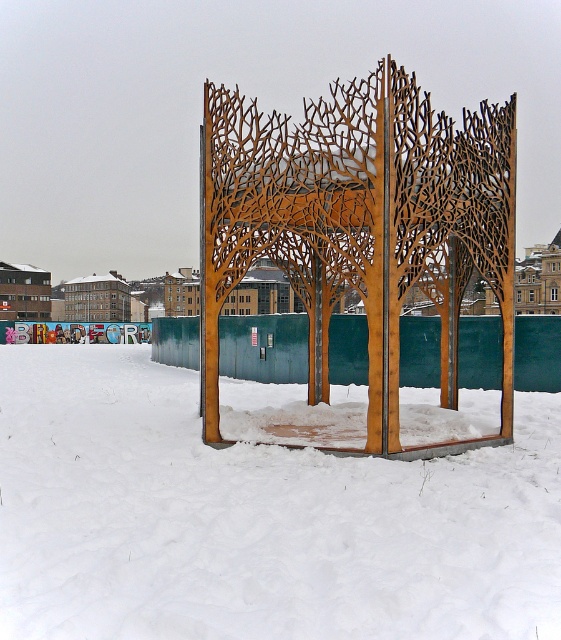
You are standing in the snowy outdoor area and want to walk towards the wooden lattice structure at center. Which direction should you move relative to the white powdery snow at lower center?

You should move towards the wooden lattice structure at center, which is behind the white powdery snow at lower center. Since the white powdery snow at lower center is in front of the wooden lattice structure at center, you need to walk past the snow area to reach the structure.

You are standing at the entrance of the metal sculpture forest. You want to walk to the point marked by the coordinates point (x=255, y=518), which is white powdery snow at lower center. Is there a clear path to reach it without stepping on any metal panels?

The white powdery snow at lower center is located at point (x=255, y=518). Since the metal sculpture panels form a semi circular or rounded enclosure and the snow is at lower center, there should be a clear path around the enclosure to reach the snow without stepping on metal panels.